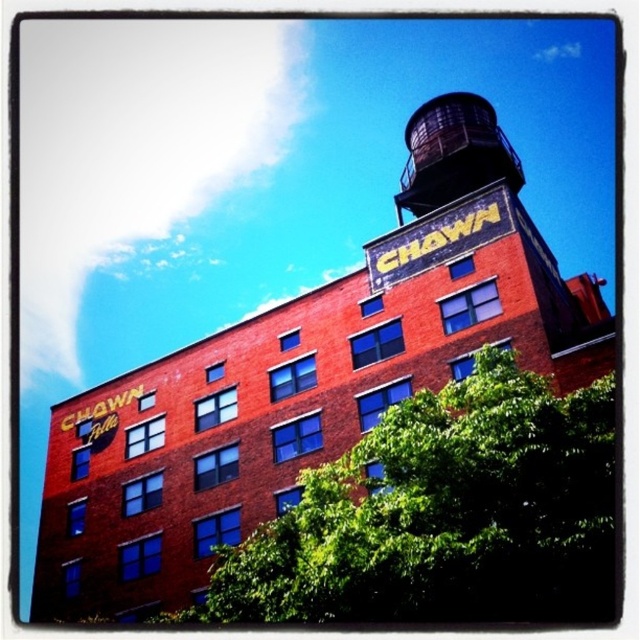
You are an urban planner assessing the space in front of the building. The green leafy tree at lower center and the dark brown metal water tower at upper center are both present. Which object takes up more area in the scene?

The dark brown metal water tower at upper center takes up more area in the scene than the green leafy tree at lower center because the green leafy tree at lower center occupies less space than dark brown metal water tower at upper center.

You are standing in front of the building and want to take a photo of the dark brown metal water tower at upper center without the green leafy tree at lower center blocking the view. Where should you move to achieve this?

Move to the side of the building away from the green leafy tree at lower center so that it is no longer in front of the dark brown metal water tower at upper center.